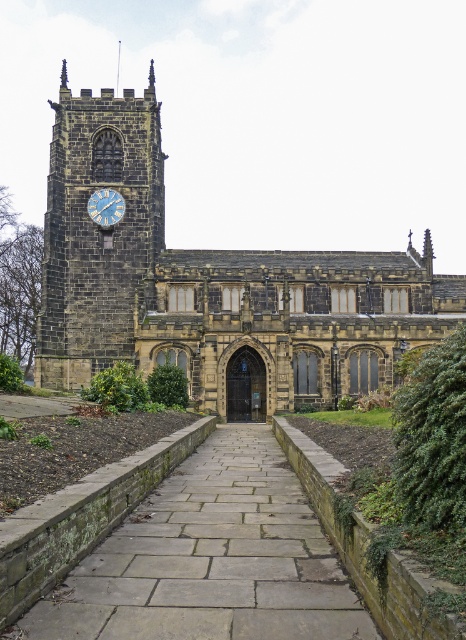
Question: Which object appears farthest from the camera in this image?

Choices:
 (A) gray stone path at center
 (B) dark gray stone clock tower at upper left
 (C) blue painted metal clock at upper left
 (D) dark gray stone church at center

Answer: (C)

Question: Does dark gray stone church at center have a smaller size compared to dark gray stone clock tower at upper left?

Choices:
 (A) yes
 (B) no

Answer: (B)

Question: Can you confirm if dark gray stone clock tower at upper left is positioned above blue painted metal clock at upper left?

Choices:
 (A) no
 (B) yes

Answer: (B)

Question: Considering the real-world distances, which object is farthest from the gray stone path at center?

Choices:
 (A) blue painted metal clock at upper left
 (B) dark gray stone church at center
 (C) dark gray stone clock tower at upper left

Answer: (A)

Question: Which point is closer to the camera?

Choices:
 (A) gray stone path at center
 (B) dark gray stone clock tower at upper left

Answer: (A)

Question: Is gray stone path at center to the right of blue painted metal clock at upper left from the viewer's perspective?

Choices:
 (A) no
 (B) yes

Answer: (B)